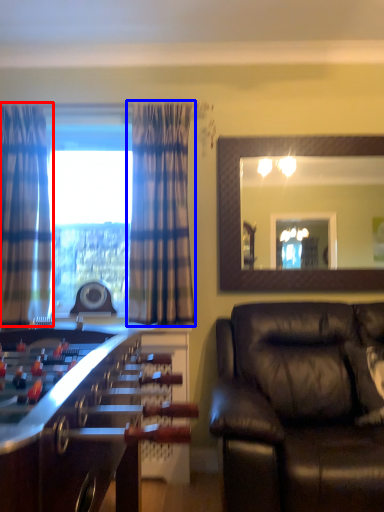
Question: Which object appears farthest to the camera in this image, curtain (highlighted by a red box) or curtain (highlighted by a blue box)?

Choices:
 (A) curtain
 (B) curtain

Answer: (B)